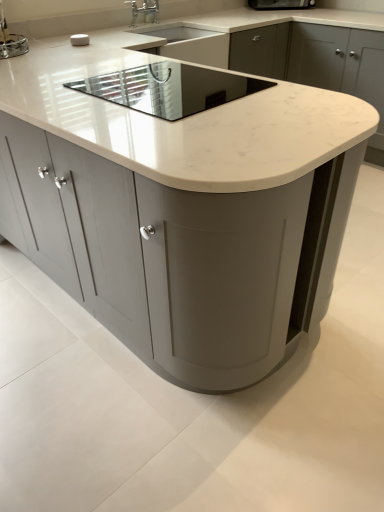
Question: From the image's perspective, is metallic silver toaster at upper left, placed as the 2th appliance when sorted from right to left, above satin nickel faucet at upper center?

Choices:
 (A) yes
 (B) no

Answer: (B)

Question: Is metallic silver toaster at upper left, arranged as the 2th appliance when viewed from the front, taller than satin nickel faucet at upper center?

Choices:
 (A) yes
 (B) no

Answer: (B)

Question: Does metallic silver toaster at upper left, the 2th appliance when ordered from bottom to top, have a smaller size compared to satin nickel faucet at upper center?

Choices:
 (A) yes
 (B) no

Answer: (B)

Question: Can you confirm if metallic silver toaster at upper left, marked as the 1th appliance in a top-to-bottom arrangement, is bigger than satin nickel faucet at upper center?

Choices:
 (A) yes
 (B) no

Answer: (A)

Question: Does metallic silver toaster at upper left, placed as the 2th appliance when sorted from right to left, have a lesser height compared to satin nickel faucet at upper center?

Choices:
 (A) yes
 (B) no

Answer: (A)

Question: From the image's perspective, is white marble countertop at center located above or below metallic silver toaster at upper left, placed as the 2th appliance when sorted from right to left?

Choices:
 (A) below
 (B) above

Answer: (A)

Question: Is white marble countertop at center spatially inside metallic silver toaster at upper left, the first appliance viewed from the left, or outside of it?

Choices:
 (A) inside
 (B) outside

Answer: (B)

Question: Considering the relative positions of white marble countertop at center and metallic silver toaster at upper left, marked as the 1th appliance in a top-to-bottom arrangement, in the image provided, is white marble countertop at center to the left or to the right of metallic silver toaster at upper left, marked as the 1th appliance in a top-to-bottom arrangement,?

Choices:
 (A) left
 (B) right

Answer: (B)

Question: Does point (248, 452) appear closer or farther from the camera than point (14, 50)?

Choices:
 (A) farther
 (B) closer

Answer: (B)

Question: From a real-world perspective, is metallic silver toaster at upper left, arranged as the 2th appliance when viewed from the front, above or below white marble countertop at center?

Choices:
 (A) below
 (B) above

Answer: (B)

Question: Considering the positions of metallic silver toaster at upper left, placed as the 2th appliance when sorted from right to left, and white marble countertop at center in the image, is metallic silver toaster at upper left, placed as the 2th appliance when sorted from right to left, wider or thinner than white marble countertop at center?

Choices:
 (A) wide
 (B) thin

Answer: (B)

Question: From the image's perspective, is metallic silver toaster at upper left, positioned as the 1th appliance in back-to-front order, above or below white marble countertop at center?

Choices:
 (A) below
 (B) above

Answer: (A)

Question: In the image, is metallic silver toaster at upper left, arranged as the 2th appliance when viewed from the front, positioned in front of or behind white marble countertop at center?

Choices:
 (A) behind
 (B) front

Answer: (B)

Question: From a real-world perspective, is white marble countertop at center above or below white marble countertop at center?

Choices:
 (A) below
 (B) above

Answer: (A)

Question: Is point (94, 492) positioned closer to the camera than point (274, 38)?

Choices:
 (A) closer
 (B) farther

Answer: (A)